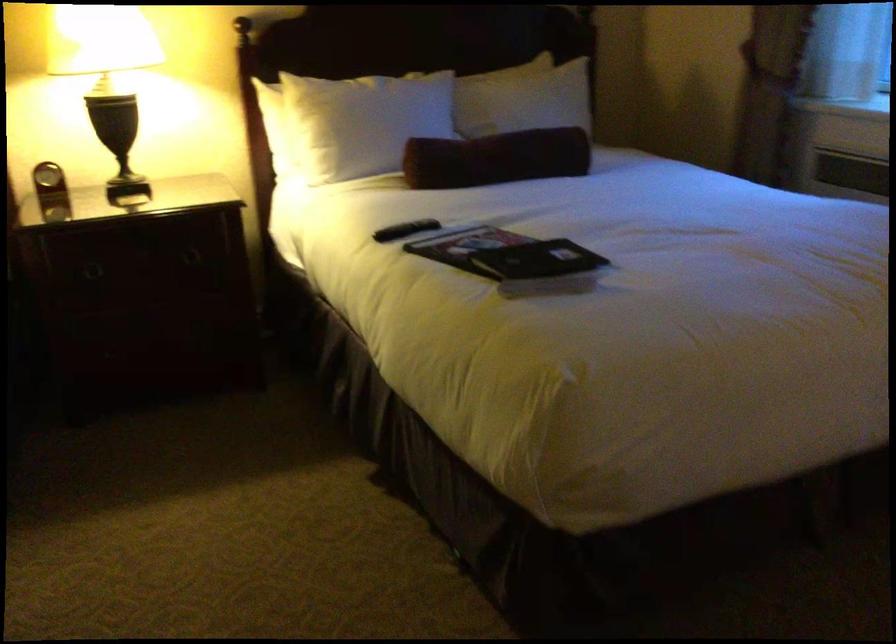
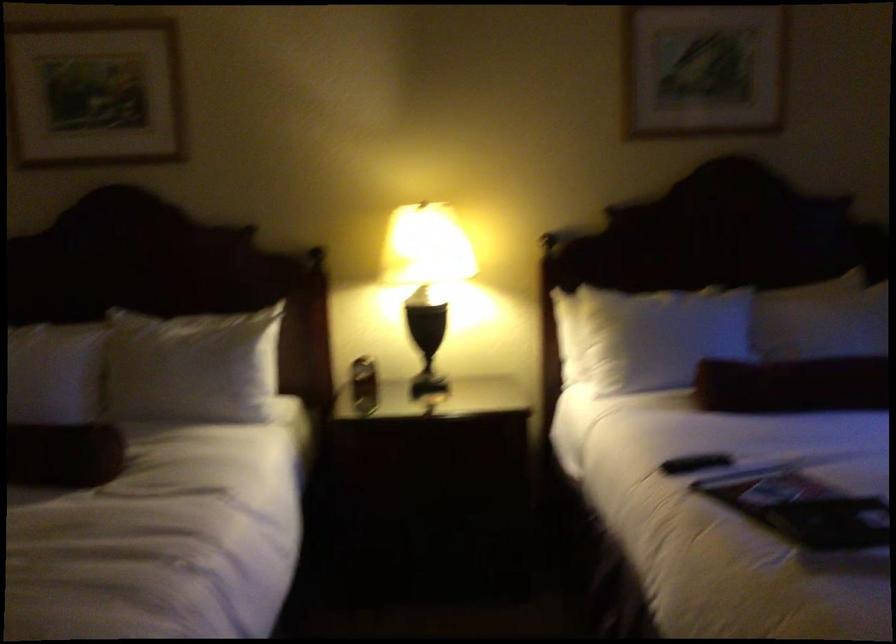
In the second image, find the point that corresponds to point (487, 156) in the first image.

(793, 384)